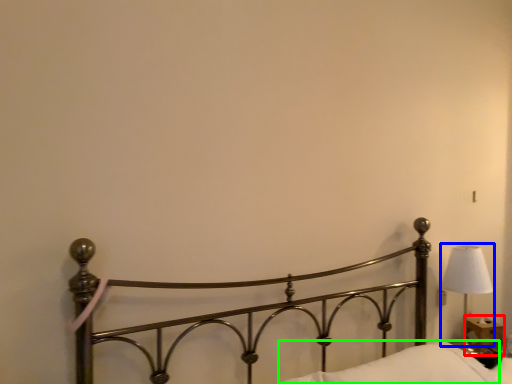
Question: Considering the real-world distances, which object is farthest from table (highlighted by a red box)? lamp (highlighted by a blue box) or pillow (highlighted by a green box)?

Choices:
 (A) lamp
 (B) pillow

Answer: (B)